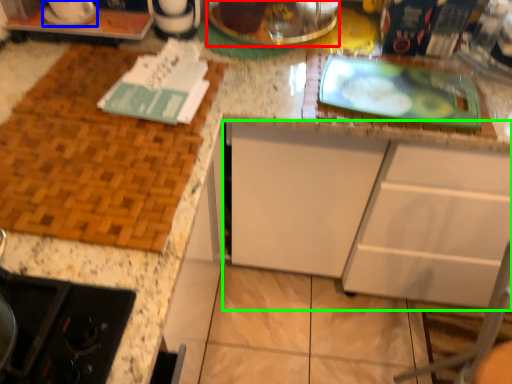
Question: Considering the real-world distances, which object is farthest from appliance (highlighted by a red box)? appliance (highlighted by a blue box) or cabinetry (highlighted by a green box)?

Choices:
 (A) appliance
 (B) cabinetry

Answer: (B)